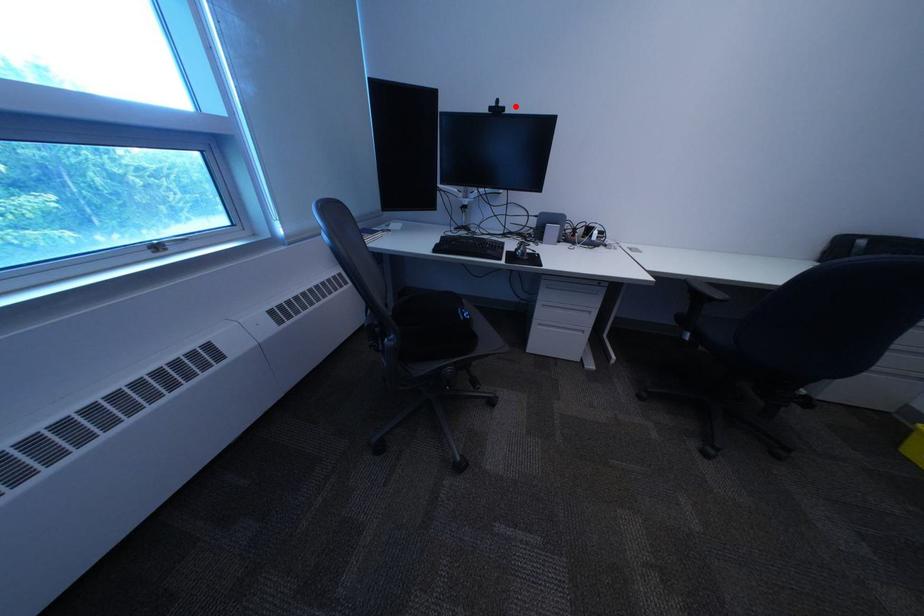
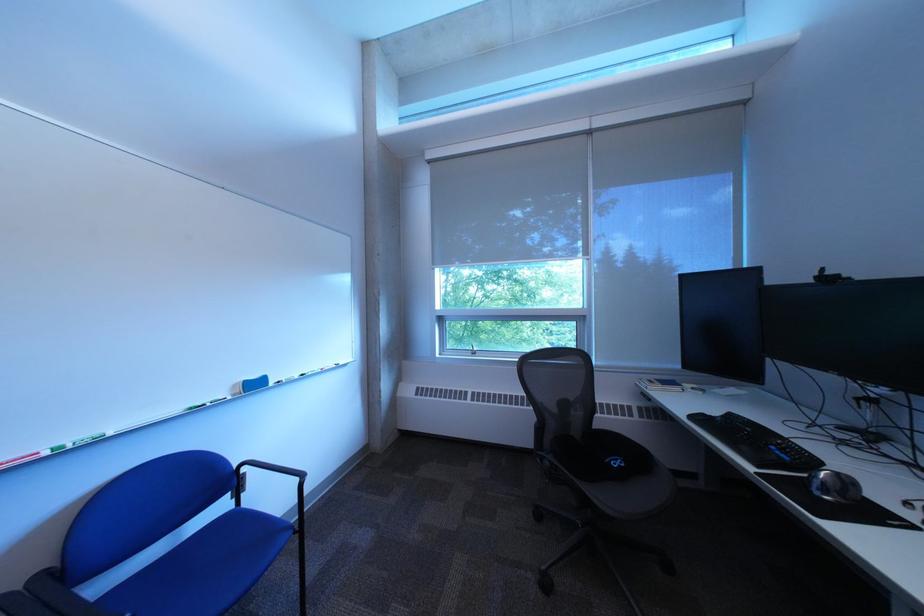
The point at the highlighted location is marked in the first image. Where is the corresponding point in the second image?

(843, 275)